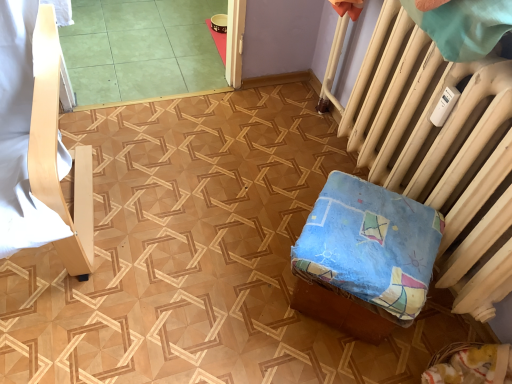
Question: Considering the relative positions of green tile at upper left and light wood chair at left, which is the second furniture from right to left, in the image provided, is green tile at upper left to the right of light wood chair at left, which is the second furniture from right to left, from the viewer's perspective?

Choices:
 (A) yes
 (B) no

Answer: (A)

Question: Is green tile at upper left oriented away from light wood chair at left, which is the second furniture from right to left?

Choices:
 (A) no
 (B) yes

Answer: (A)

Question: Is light wood chair at left, which is the second furniture from right to left, surrounded by green tile at upper left?

Choices:
 (A) no
 (B) yes

Answer: (A)

Question: Considering the relative sizes of green tile at upper left and light wood chair at left, which is the second furniture from right to left, in the image provided, is green tile at upper left taller than light wood chair at left, which is the second furniture from right to left,?

Choices:
 (A) yes
 (B) no

Answer: (B)

Question: Does green tile at upper left have a lesser height compared to light wood chair at left, which is the second furniture from right to left?

Choices:
 (A) no
 (B) yes

Answer: (B)

Question: Are green tile at upper left and light wood chair at left, which is the second furniture from right to left, making contact?

Choices:
 (A) no
 (B) yes

Answer: (A)

Question: Does blue fabric cushion at lower right, marked as the second furniture in a left-to-right arrangement, have a greater width compared to white painted radiator at right?

Choices:
 (A) yes
 (B) no

Answer: (A)

Question: Does blue fabric cushion at lower right, marked as the second furniture in a left-to-right arrangement, lie in front of white painted radiator at right?

Choices:
 (A) yes
 (B) no

Answer: (B)

Question: From the image's perspective, is blue fabric cushion at lower right, marked as the second furniture in a left-to-right arrangement, on top of white painted radiator at right?

Choices:
 (A) no
 (B) yes

Answer: (A)

Question: Does blue fabric cushion at lower right, which appears as the first furniture when viewed from the right, appear on the left side of white painted radiator at right?

Choices:
 (A) no
 (B) yes

Answer: (B)

Question: Is blue fabric cushion at lower right, which appears as the first furniture when viewed from the right, thinner than white painted radiator at right?

Choices:
 (A) no
 (B) yes

Answer: (A)

Question: Would you consider blue fabric cushion at lower right, which appears as the first furniture when viewed from the right, to be distant from white painted radiator at right?

Choices:
 (A) yes
 (B) no

Answer: (B)

Question: Considering the relative sizes of white painted radiator at right and light wood chair at left, the first furniture viewed from the left, in the image provided, is white painted radiator at right wider than light wood chair at left, the first furniture viewed from the left,?

Choices:
 (A) no
 (B) yes

Answer: (A)